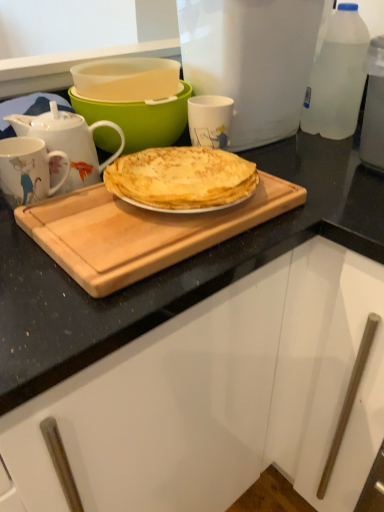
Identify the location of free space above wooden cutting board at center (from a real-world perspective). This screenshot has height=512, width=384. (129, 211).